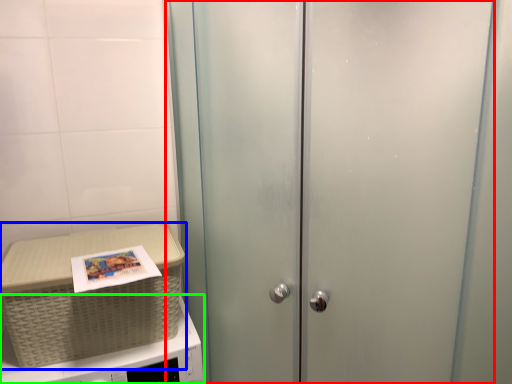
Question: Based on their relative distances, which object is nearer to door (highlighted by a red box)? Choose from picnic basket (highlighted by a blue box) and microwave oven (highlighted by a green box).

Choices:
 (A) picnic basket
 (B) microwave oven

Answer: (A)